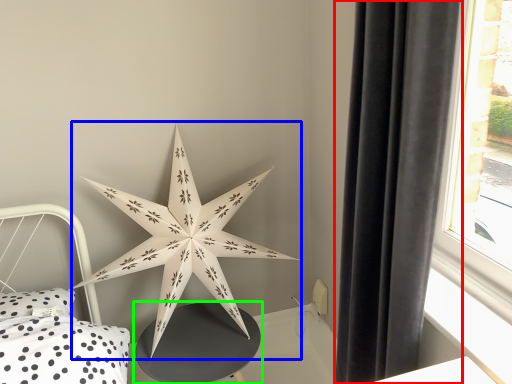
Question: Considering the real-world distances, which object is closest to curtain (highlighted by a red box)? star (highlighted by a blue box) or table (highlighted by a green box).

Choices:
 (A) star
 (B) table

Answer: (A)